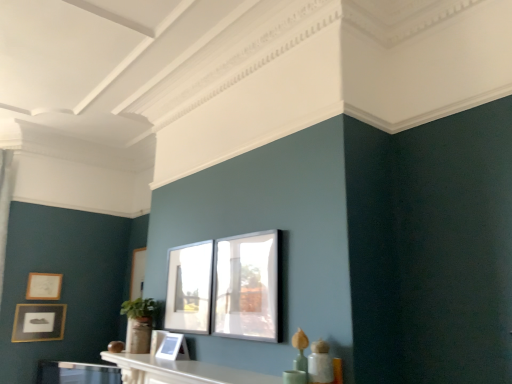
At what (x,y) coordinates should I click in order to perform the action: click on free location to the left of matte white picture frame at center, the 3th picture frame when ordered from left to right. Please return your answer as a coordinate pair (x, y). The image size is (512, 384). Looking at the image, I should click on (140, 360).